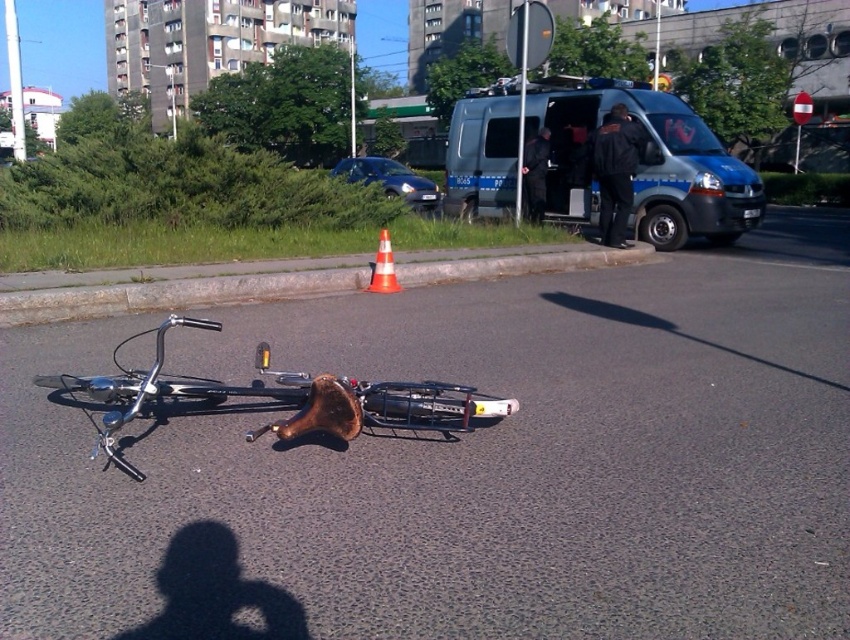
Which is behind, point (213, 273) or point (375, 410)?

Point (213, 273)

Does concrete curb at lower center have a greater height compared to shiny metallic bicycle at lower center?

Indeed, concrete curb at lower center has a greater height compared to shiny metallic bicycle at lower center.

At what (x,y) coordinates should I click in order to perform the action: click on concrete curb at lower center. Please return your answer as a coordinate pair (x, y). Looking at the image, I should click on (170, 289).

You are a GUI agent. You are given a task and a screenshot of the screen. Output one action in this format:
    pyautogui.click(x=<x>, y=<y>)
    Task: Click on the concrete curb at lower center
    
    Given the screenshot: What is the action you would take?
    pyautogui.click(x=170, y=289)

Can you confirm if concrete curb at lower center is shorter than orange plastic traffic cone at center?

No, concrete curb at lower center is not shorter than orange plastic traffic cone at center.

Is concrete curb at lower center positioned in front of orange plastic traffic cone at center?

Yes, it is in front of orange plastic traffic cone at center.

The width and height of the screenshot is (850, 640). Identify the location of concrete curb at lower center. [x=170, y=289].

This screenshot has width=850, height=640. I want to click on concrete curb at lower center, so click(x=170, y=289).

At what (x,y) coordinates should I click in order to perform the action: click on blue metallic van at center. Please return your answer as a coordinate pair (x, y). Looking at the image, I should click on (644, 163).

Is blue metallic van at center positioned behind shiny metallic bicycle at lower center?

Yes, it is behind shiny metallic bicycle at lower center.

Is point (584, 172) positioned in front of point (429, 392)?

No, it is not.

Locate an element on the screen. blue metallic van at center is located at coordinates (644, 163).